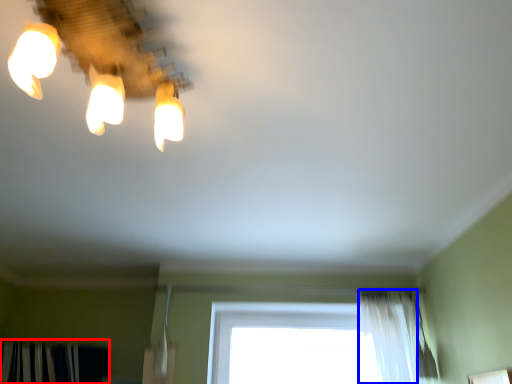
Question: Which of the following is the farthest to the observer, curtain (highlighted by a red box) or shower curtain (highlighted by a blue box)?

Choices:
 (A) curtain
 (B) shower curtain

Answer: (A)